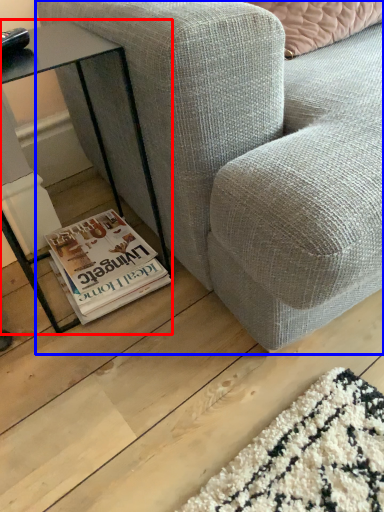
Question: Which of the following is the closest to the observer, table (highlighted by a red box) or studio couch (highlighted by a blue box)?

Choices:
 (A) table
 (B) studio couch

Answer: (B)